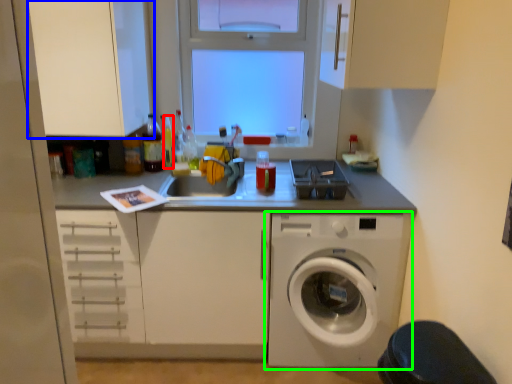
Question: Considering the real-world distances, which object is farthest from bottle (highlighted by a red box)? cabinetry (highlighted by a blue box) or washing machine (highlighted by a green box)?

Choices:
 (A) cabinetry
 (B) washing machine

Answer: (B)